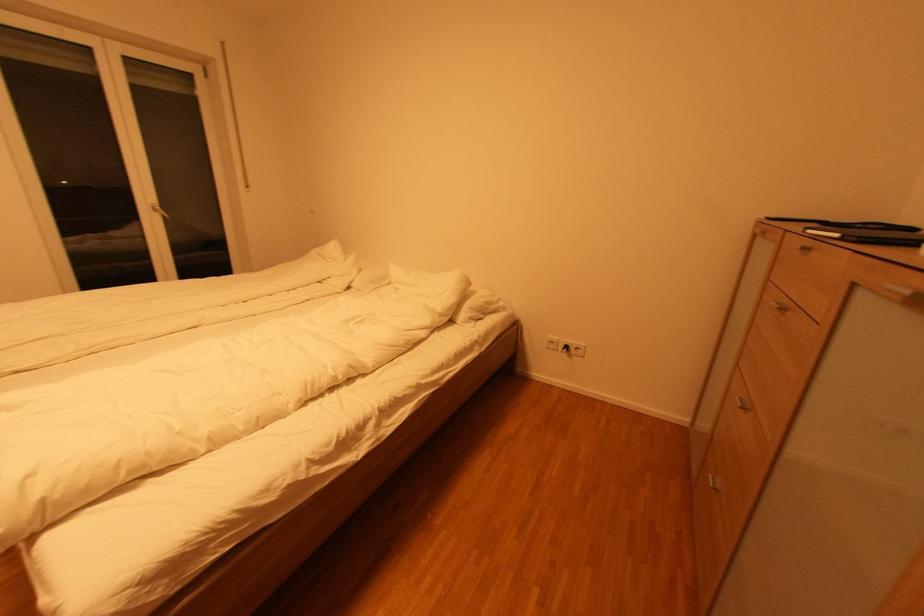
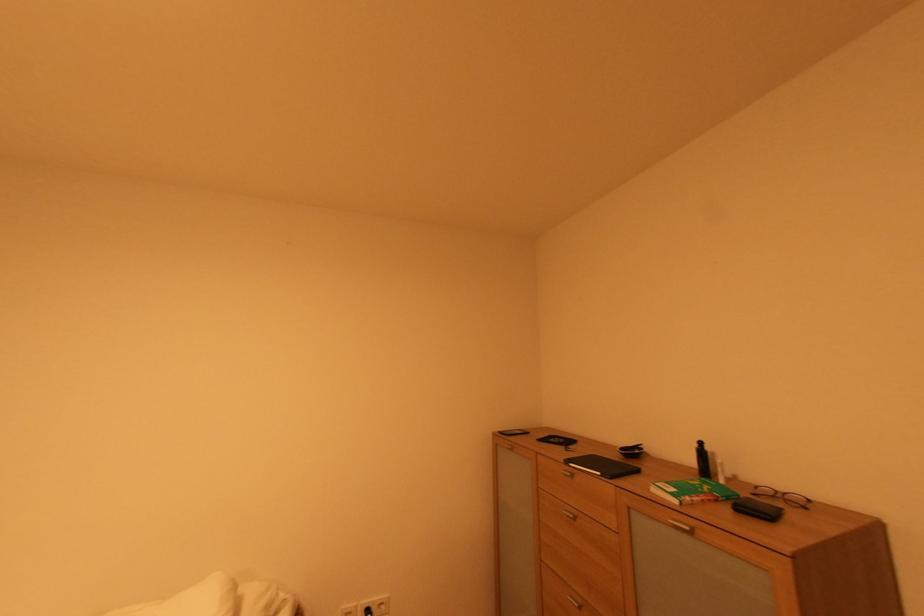
Find the pixel in the second image that matches the point at 748,400 in the first image.

(578, 599)